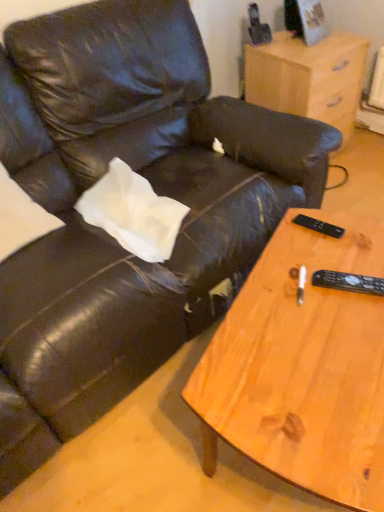
Identify the location of vacant region in front of black plastic remote at right, the first remote viewed from the back. Image resolution: width=384 pixels, height=512 pixels. (326, 267).